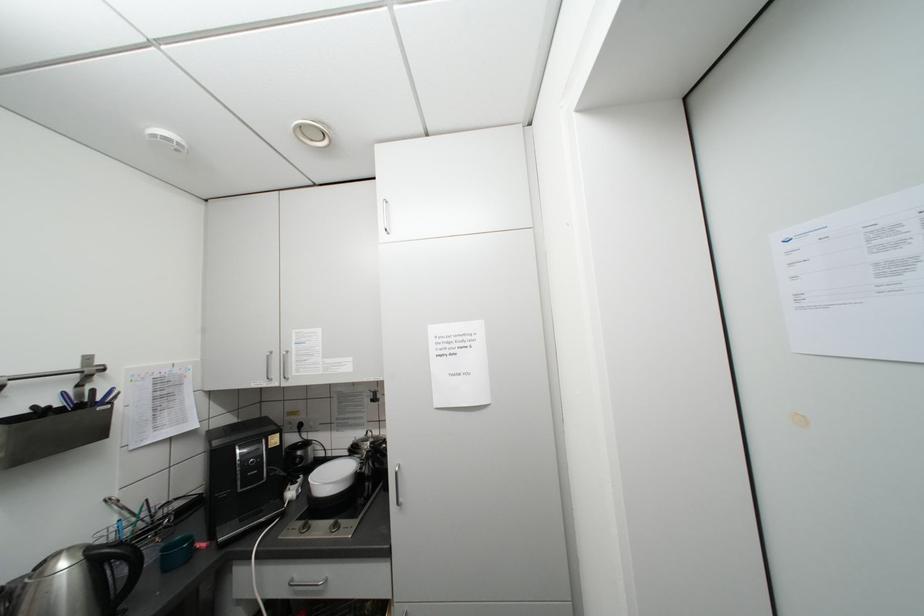
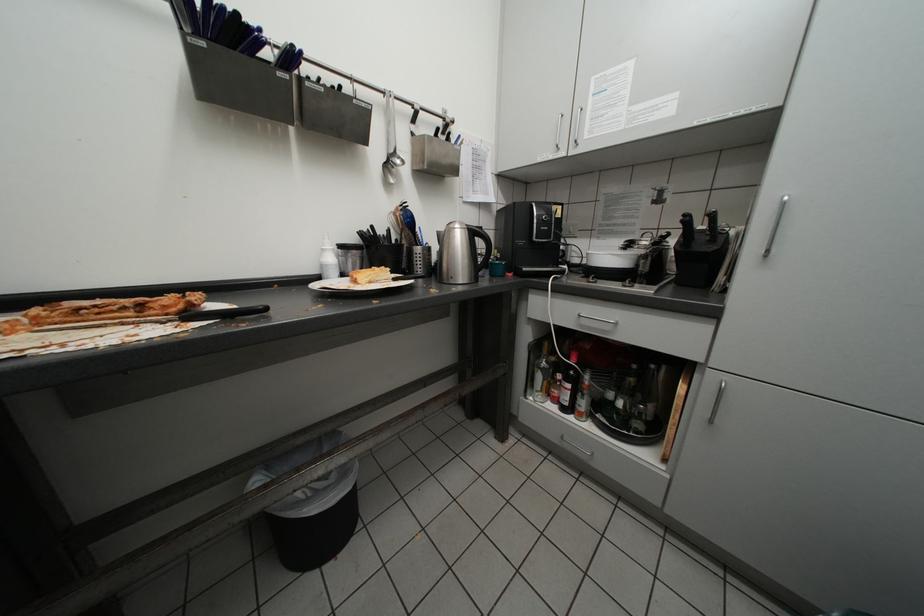
How did the camera likely rotate?

The camera rotated toward left-down.